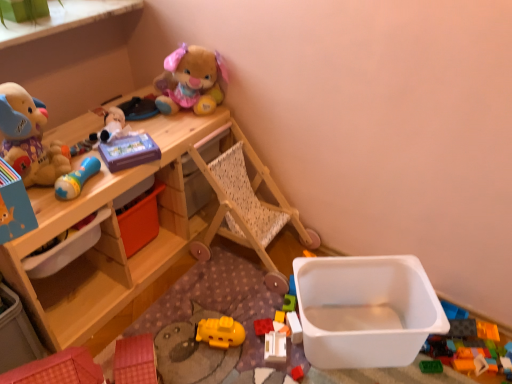
Image resolution: width=512 pixels, height=384 pixels. What are the coordinates of `unoccupied space behind purple matte tissue box at upper center, marked as the seventh toy in a bottom-to-top arrangement` in the screenshot? It's located at (166, 127).